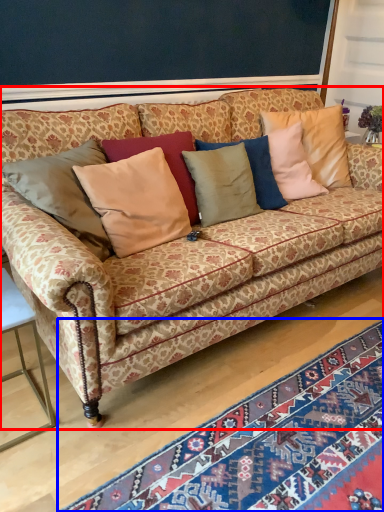
Question: Which point is closer to the camera, studio couch (highlighted by a red box) or mat (highlighted by a blue box)?

Choices:
 (A) studio couch
 (B) mat

Answer: (B)